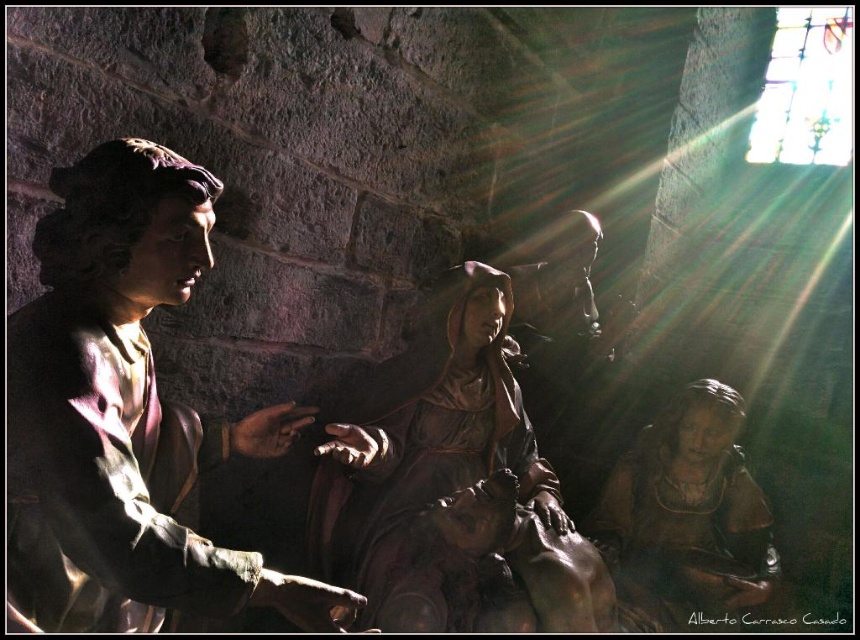
Question: Can you confirm if brown polished wood statue at center is positioned to the left of brown matte statue at lower right?

Choices:
 (A) yes
 (B) no

Answer: (A)

Question: Which object appears farthest from the camera in this image?

Choices:
 (A) matte bronze statue at left
 (B) brown polished wood statue at center
 (C) brown matte statue at lower right

Answer: (C)

Question: Which of these objects is positioned farthest from the matte bronze statue at left?

Choices:
 (A) brown polished wood statue at center
 (B) brown matte statue at lower right

Answer: (B)

Question: Which of the following is the farthest from the observer?

Choices:
 (A) (416, 461)
 (B) (631, 470)

Answer: (B)

Question: From the image, what is the correct spatial relationship of brown polished wood statue at center in relation to brown matte statue at lower right?

Choices:
 (A) left
 (B) right

Answer: (A)

Question: Does matte bronze statue at left appear under brown polished wood statue at center?

Choices:
 (A) yes
 (B) no

Answer: (B)